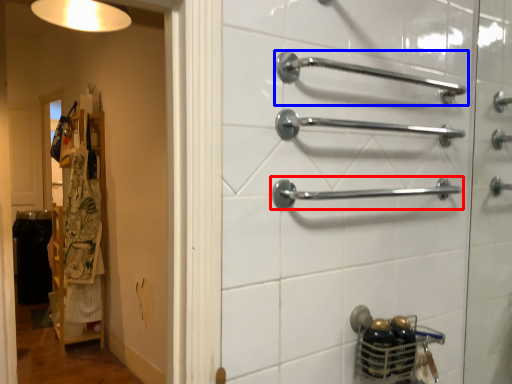
Question: Which of the following is the farthest to the observer, towel rack (highlighted by a red box) or towel rack (highlighted by a blue box)?

Choices:
 (A) towel rack
 (B) towel rack

Answer: (A)